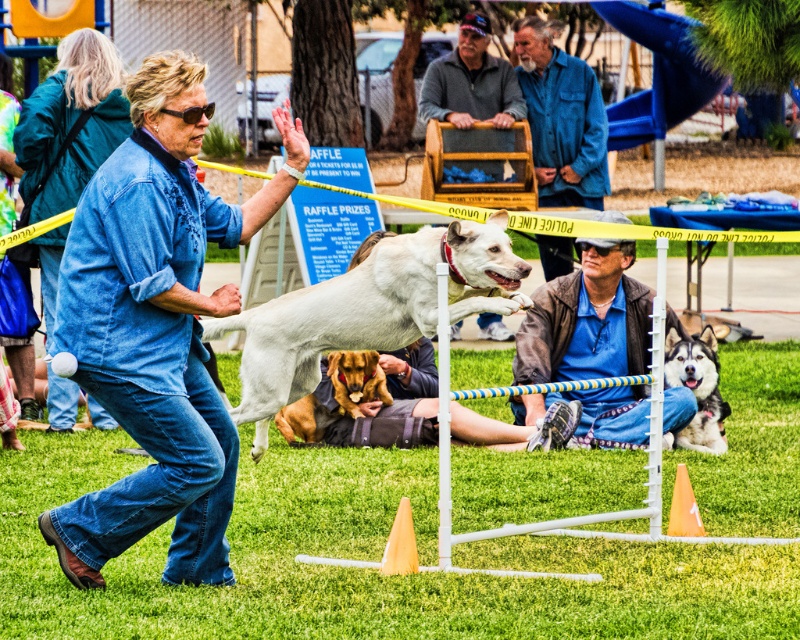
Question: Which object appears farthest from the camera in this image?

Choices:
 (A) brown fur dog at center
 (B) white smooth dog at center

Answer: (A)

Question: Which object is positioned farthest from the blue denim jacket at upper center?

Choices:
 (A) white smooth dog at center
 (B) denim jacket at center
 (C) denim jacket at upper left
 (D) shiny brown fur at center

Answer: (C)

Question: Which object is the closest to the brown fur dog at center?

Choices:
 (A) shiny brown fur at center
 (B) blue denim jacket at upper center
 (C) white smooth dog at center

Answer: (A)

Question: Is denim jacket at upper left to the right of brown fur dog at center from the viewer's perspective?

Choices:
 (A) no
 (B) yes

Answer: (A)

Question: Is silky black fur at center below shiny brown fur at center?

Choices:
 (A) no
 (B) yes

Answer: (B)

Question: Is denim jacket at center thinner than shiny brown fur at center?

Choices:
 (A) no
 (B) yes

Answer: (A)